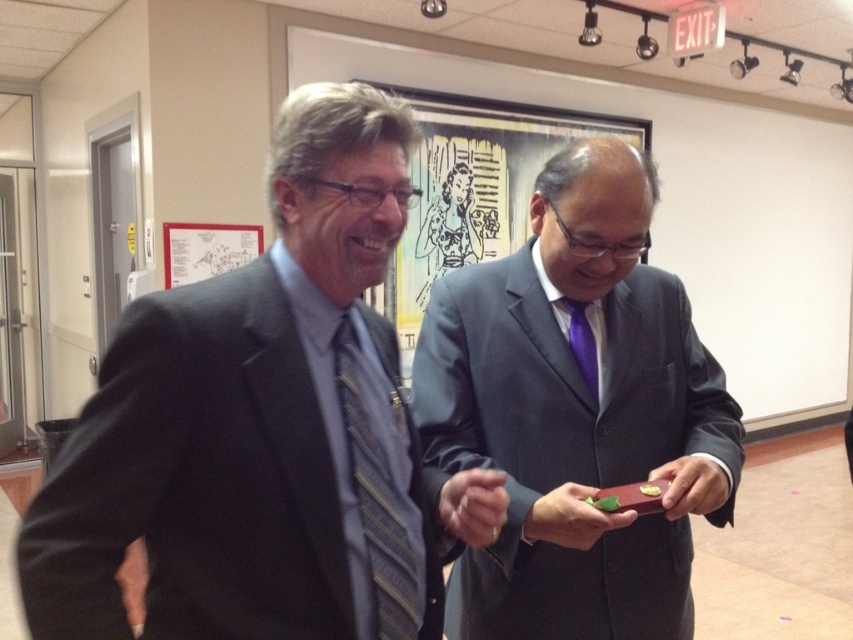
Is matte black framed artwork at center to the left of purple satin tie at center from the viewer's perspective?

No, matte black framed artwork at center is not to the left of purple satin tie at center.

Is matte black framed artwork at center smaller than purple satin tie at center?

No, matte black framed artwork at center is not smaller than purple satin tie at center.

Is point (531, 180) farther from camera compared to point (581, 333)?

Yes, point (531, 180) is farther from viewer.

Locate an element on the screen. This screenshot has width=853, height=640. matte black framed artwork at center is located at coordinates (476, 186).

Is matte gray suit at left to the left of matte purple tie at center from the viewer's perspective?

Yes, matte gray suit at left is to the left of matte purple tie at center.

Between matte gray suit at left and matte purple tie at center, which one has more height?

matte purple tie at center is taller.

The width and height of the screenshot is (853, 640). What are the coordinates of `matte gray suit at left` in the screenshot? It's located at (254, 432).

Is matte black framed artwork at center bigger than striped fabric tie at center?

Correct, matte black framed artwork at center is larger in size than striped fabric tie at center.

Between matte black framed artwork at center and striped fabric tie at center, which one appears on the left side from the viewer's perspective?

striped fabric tie at center is more to the left.

Locate an element on the screen. matte black framed artwork at center is located at coordinates (476, 186).